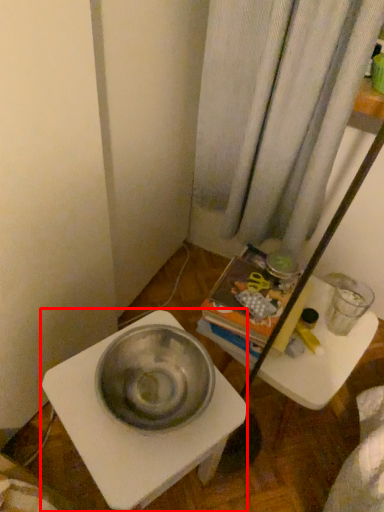
Question: From the image's perspective, what is the correct spatial positioning of table (annotated by the red box) in reference to vanity?

Choices:
 (A) below
 (B) above

Answer: (A)